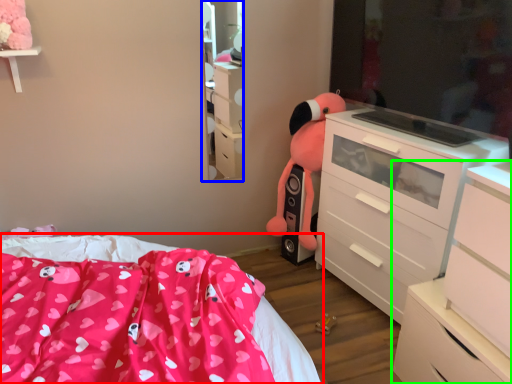
Question: Considering the real-world distances, which object is farthest from bed (highlighted by a red box)? mirror (highlighted by a blue box) or chest of drawers (highlighted by a green box)?

Choices:
 (A) mirror
 (B) chest of drawers

Answer: (A)